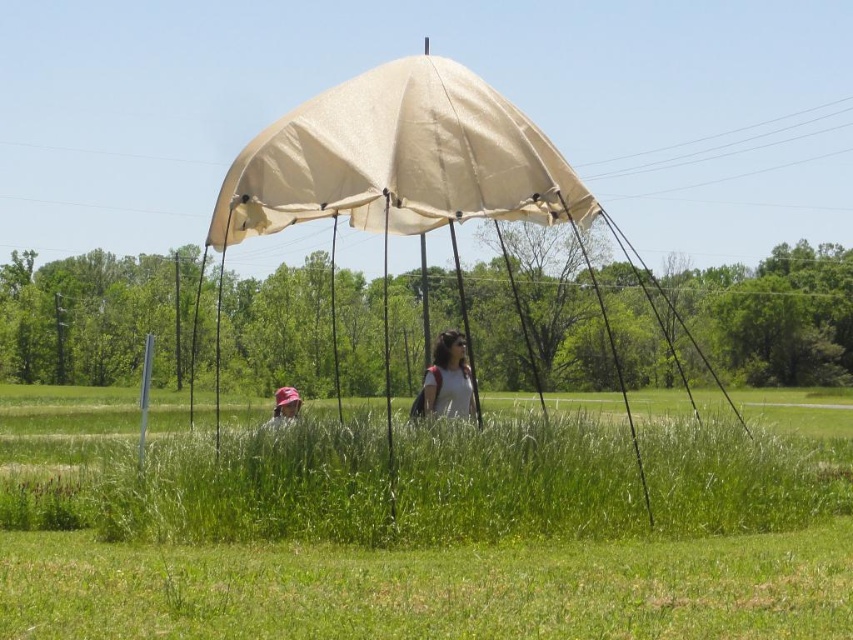
You are standing at the center of the canopy and want to place a small table exactly at the center of the beige canvas umbrella at center. According to the coordinates provided, where should you place the table?

The beige canvas umbrella at center is located at point (408, 180), so you should place the table at those coordinates to position it exactly at the center of the beige canvas umbrella at center.

You are standing at point [293,396] and want to move to point [215,406]. Given that the area under the canopy is clear of obstacles, can you walk directly to your destination?

Yes, you can walk directly to point [215,406] from point [293,396] because the area under the canopy is clear of obstacles and there is no mention of any hindrance between them.